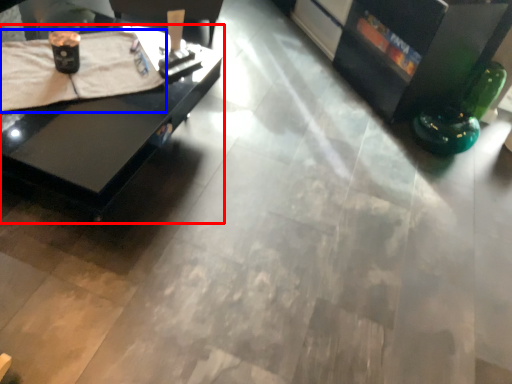
Question: Which point is closer to the camera, table (highlighted by a red box) or blanket (highlighted by a blue box)?

Choices:
 (A) table
 (B) blanket

Answer: (A)